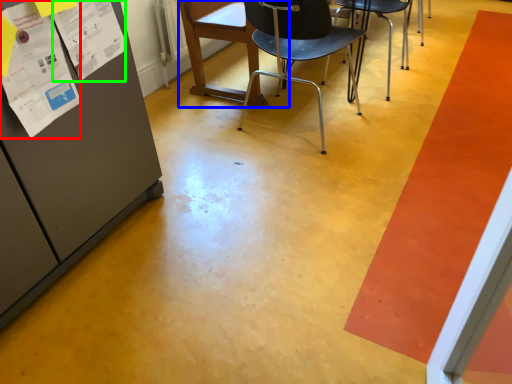
Question: Which object is the farthest from poster (highlighted by a red box)? Choose among these: chair (highlighted by a blue box) or poster (highlighted by a green box).

Choices:
 (A) chair
 (B) poster

Answer: (A)